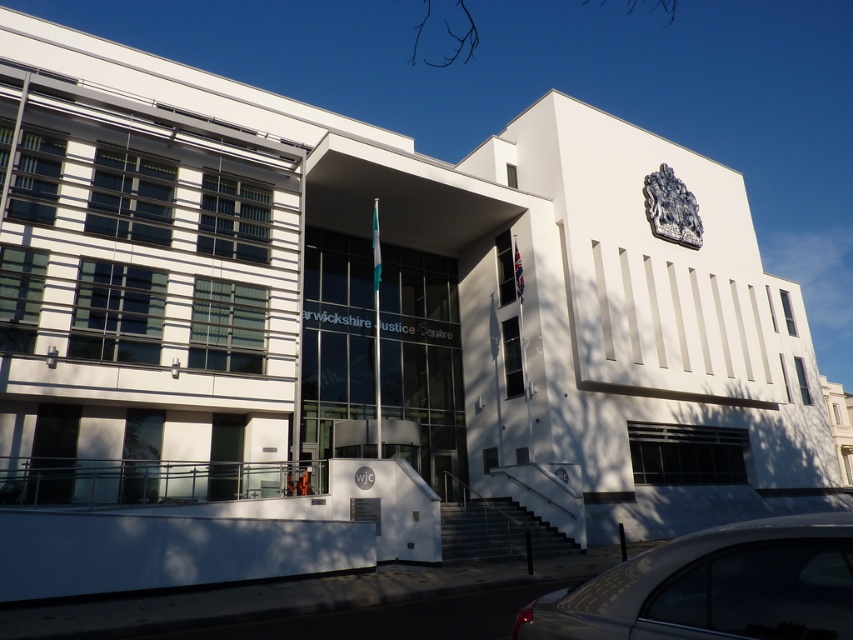
You are a photographer positioned in front of the Warwickshire Justice Centre. You want to capture both the silver metallic car at lower right and the silver metallic emblem at upper center in your shot. Which object appears narrower in the photo?

The silver metallic car at lower right appears narrower than the silver metallic emblem at upper center in the photo.

Based on the photo, you are a photographer positioned at the front of the Warwickshire Justice Centre. You notice a silver metallic car at lower right and a silver metallic emblem at upper center. Which object appears taller in the image?

The silver metallic emblem at upper center appears taller than the silver metallic car at lower right.